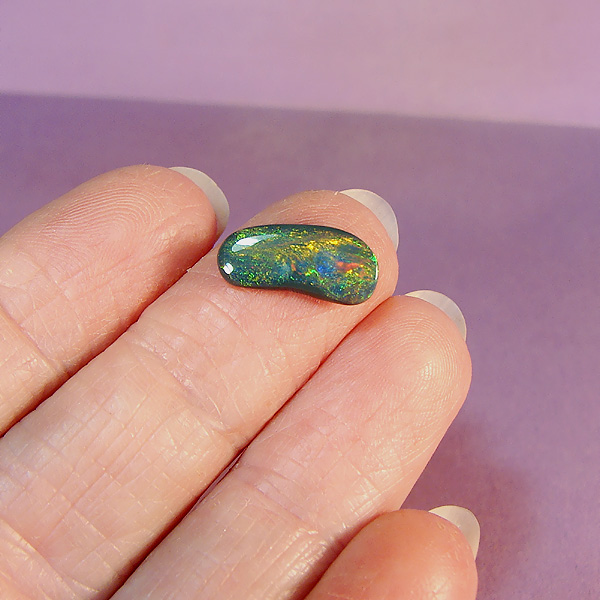
Locate an element on the screen. This screenshot has width=600, height=600. purple fabric is located at coordinates (499, 184).